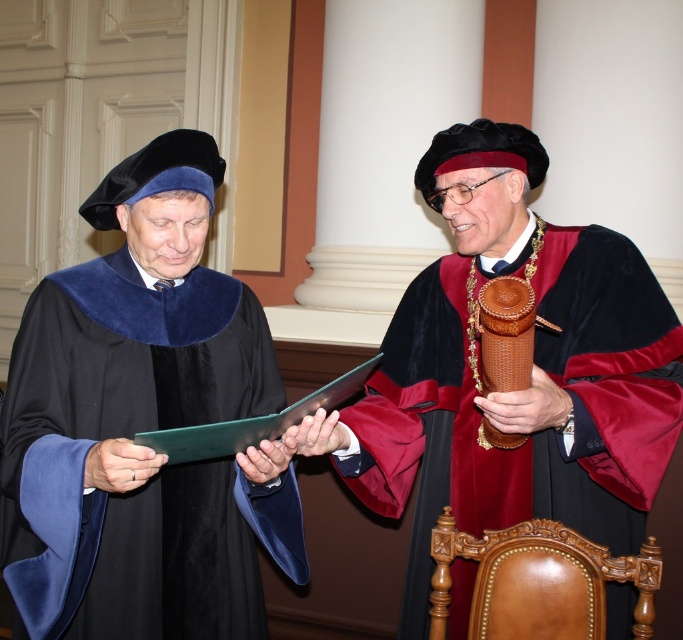
Question: Where is velvet black robe at left located in relation to velvet maroon and black gown at center in the image?

Choices:
 (A) right
 (B) left

Answer: (B)

Question: Does velvet black robe at left appear on the left side of velvet maroon and black gown at center?

Choices:
 (A) no
 (B) yes

Answer: (B)

Question: Which point appears closest to the camera in this image?

Choices:
 (A) (240, 404)
 (B) (591, 456)

Answer: (B)

Question: Can you confirm if velvet black robe at left is positioned above velvet maroon and black gown at center?

Choices:
 (A) yes
 (B) no

Answer: (B)

Question: Among these points, which one is nearest to the camera?

Choices:
 (A) (204, 593)
 (B) (635, 340)

Answer: (A)